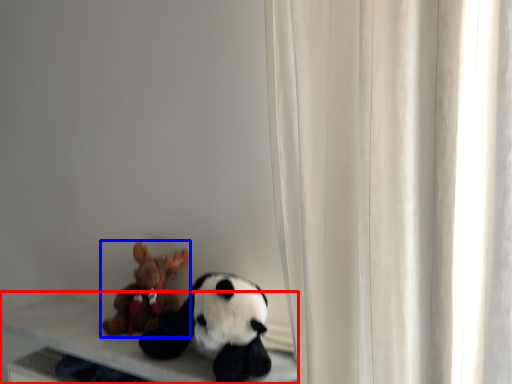
Question: Which of the following is the closest to the observer, table (highlighted by a red box) or toy (highlighted by a blue box)?

Choices:
 (A) table
 (B) toy

Answer: (A)